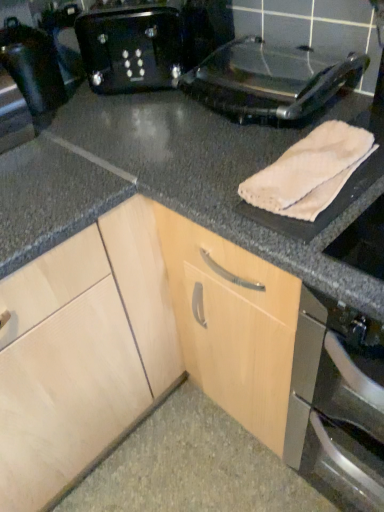
Where is `free point behind beige soft towel at upper right`? The image size is (384, 512). free point behind beige soft towel at upper right is located at coordinates (258, 136).